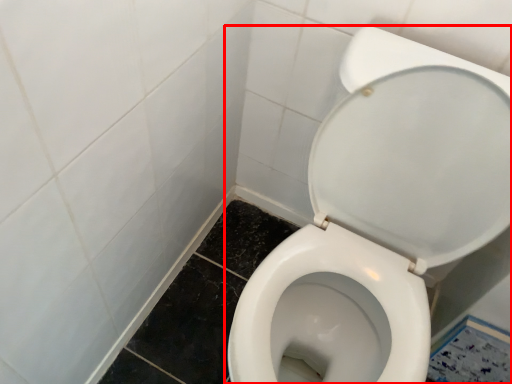
Question: From the image, what is the correct spatial relationship of toilet (annotated by the red box) in relation to square?

Choices:
 (A) left
 (B) right

Answer: (A)